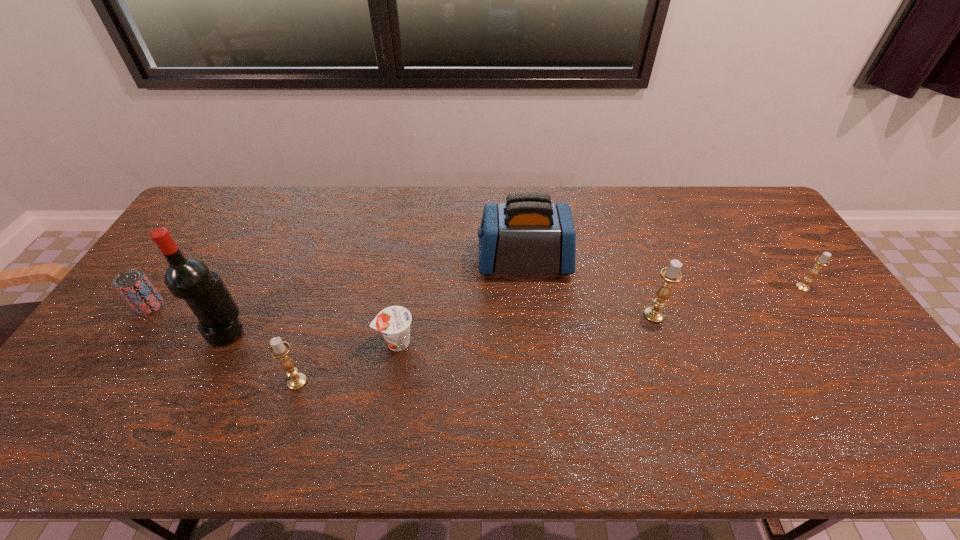
If we want them evenly spaced by inserting an extra candle_holder among them, please locate a free spot for this new candle_holder. Please provide its 2D coordinates. Your answer should be formatted as a tuple, i.e. [(x, y)], where the tuple contains the x and y coordinates of a point satisfying the conditions above.

[(487, 346)]